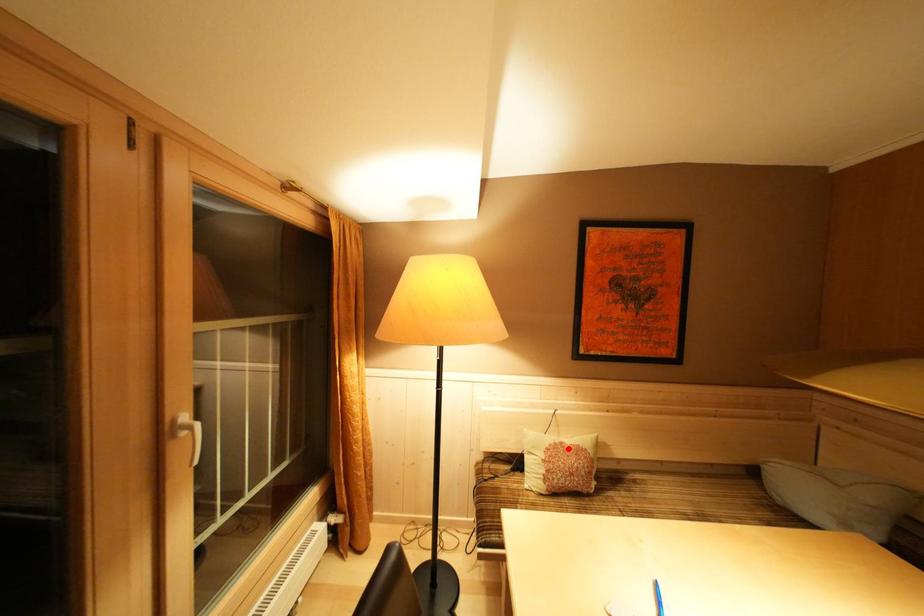
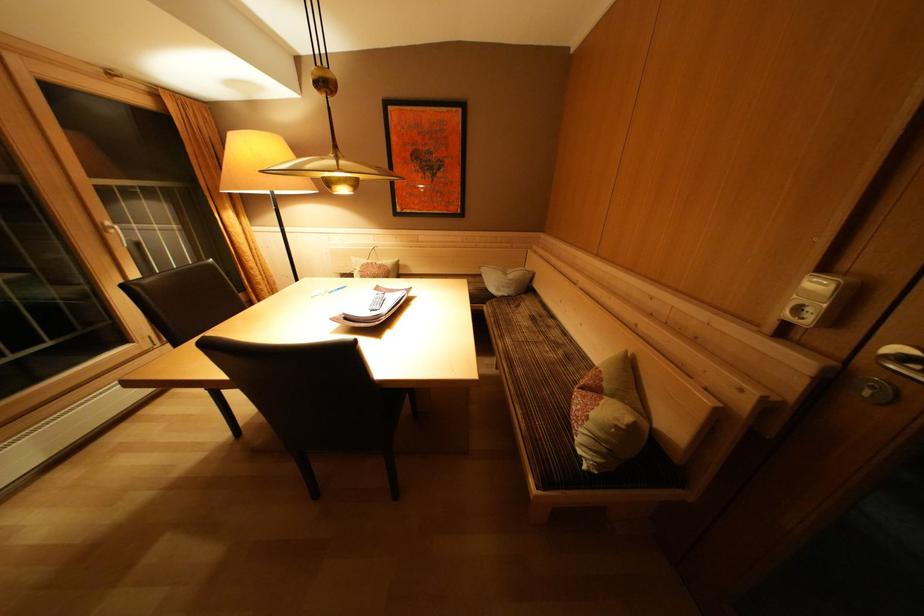
Question: I am providing you with two images of the same scene from different viewpoints. A red point is shown in image1. For the corresponding object point in image2, is it positioned nearer or farther from the camera?

Choices:
 (A) Nearer
 (B) Farther

Answer: (A)